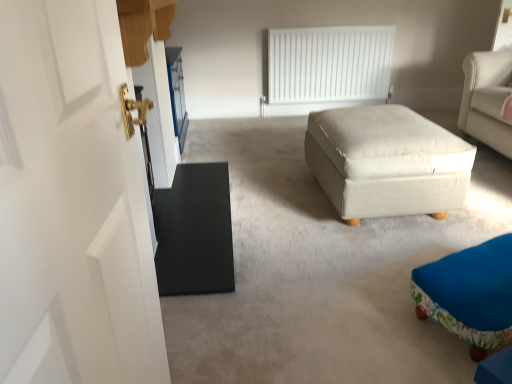
Find the location of a particular element. This screenshot has height=384, width=512. free space above floral fabric ottoman at lower right (from a real-world perspective) is located at coordinates (484, 267).